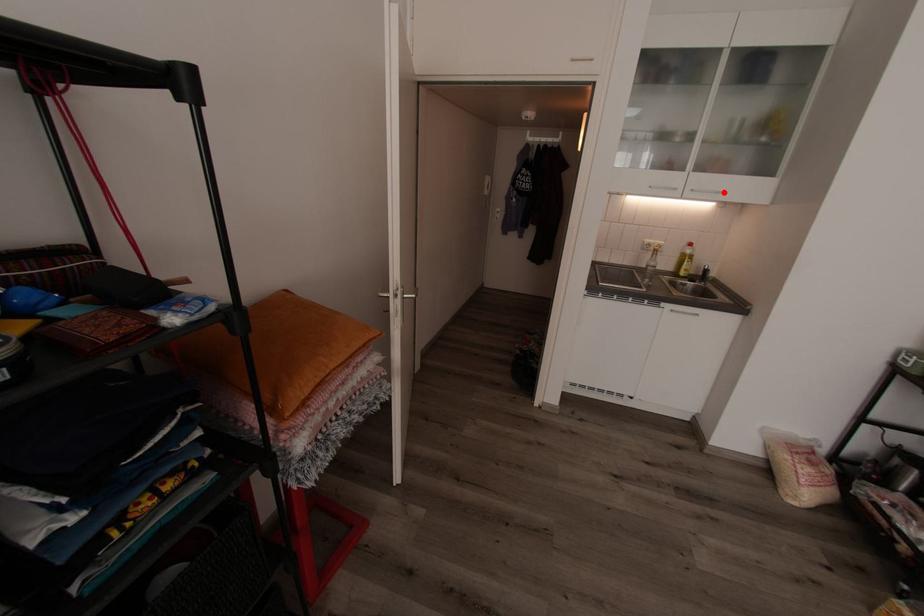
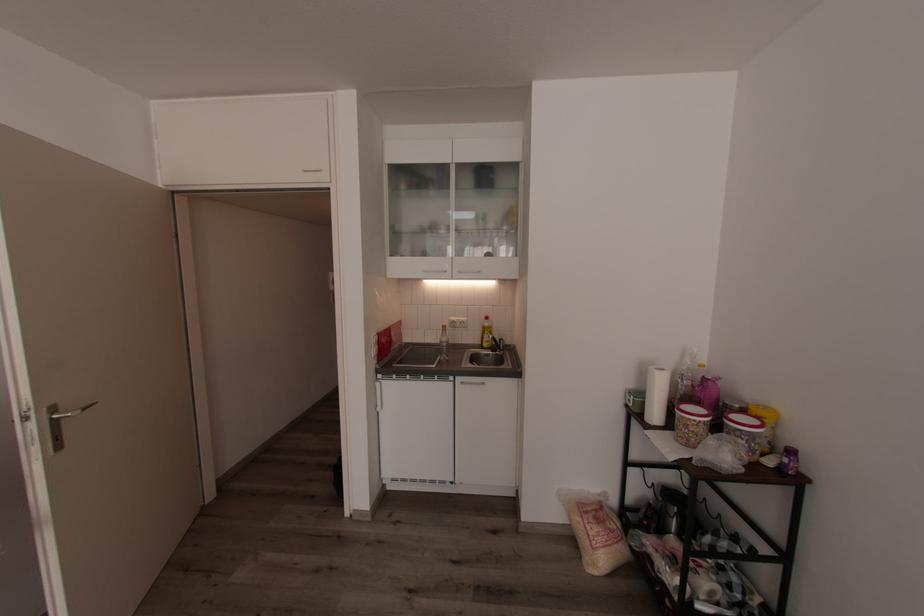
The point at the highlighted location is marked in the first image. Where is the corresponding point in the second image?

(484, 272)